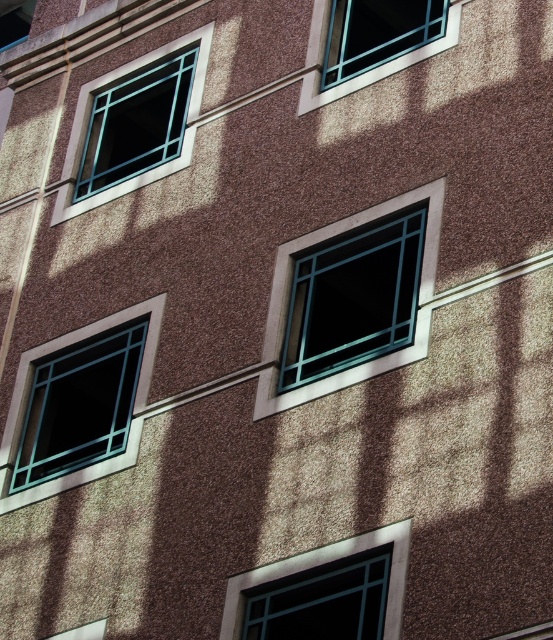
Who is taller, matte glass window at lower right or matte glass window at upper left?

Standing taller between the two is matte glass window at lower right.

Does point (336, 625) come closer to viewer compared to point (2, 24)?

That is True.

The image size is (553, 640). Identify the location of matte glass window at lower right. click(324, 602).

Is matte glass window at lower right in front of matte teal glass window at upper right?

That is True.

Can you confirm if matte glass window at lower right is positioned to the right of matte teal glass window at upper right?

In fact, matte glass window at lower right is to the left of matte teal glass window at upper right.

The width and height of the screenshot is (553, 640). What are the coordinates of `matte glass window at lower right` in the screenshot? It's located at (324, 602).

Where is `matte glass window at lower right`? matte glass window at lower right is located at coordinates (324, 602).

Is green glass window at center thinner than matte glass window at lower right?

No, green glass window at center is not thinner than matte glass window at lower right.

Does point (397, 298) come farther from viewer compared to point (338, 572)?

That is True.

Between point (357, 259) and point (320, 605), which one is positioned in front?

Point (320, 605) is more forward.

Find the location of a particular element. The width and height of the screenshot is (553, 640). green glass window at center is located at coordinates (352, 300).